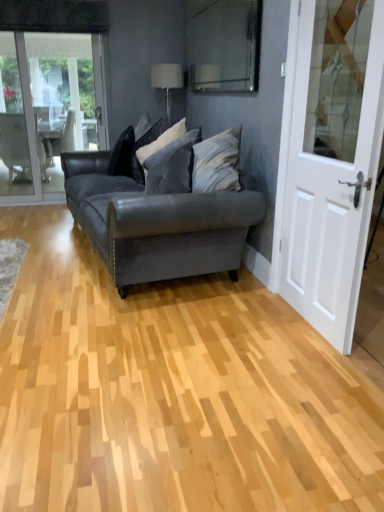
Question: From a real-world perspective, is transparent glass window screen at upper center below white wooden door at right?

Choices:
 (A) yes
 (B) no

Answer: (B)

Question: Is transparent glass window screen at upper center to the left of white wooden door at right from the viewer's perspective?

Choices:
 (A) no
 (B) yes

Answer: (B)

Question: Does transparent glass window screen at upper center appear on the right side of white wooden door at right?

Choices:
 (A) no
 (B) yes

Answer: (A)

Question: From the image's perspective, is transparent glass window screen at upper center below white wooden door at right?

Choices:
 (A) yes
 (B) no

Answer: (B)

Question: Can you confirm if transparent glass window screen at upper center is wider than white wooden door at right?

Choices:
 (A) no
 (B) yes

Answer: (A)

Question: Is transparent glass window screen at upper center thinner than white wooden door at right?

Choices:
 (A) no
 (B) yes

Answer: (B)

Question: Considering the relative sizes of matte black couch at center and transparent glass window screen at upper center in the image provided, is matte black couch at center taller than transparent glass window screen at upper center?

Choices:
 (A) yes
 (B) no

Answer: (A)

Question: From the image's perspective, is matte black couch at center under transparent glass window screen at upper center?

Choices:
 (A) no
 (B) yes

Answer: (B)

Question: Is matte black couch at center surrounding transparent glass window screen at upper center?

Choices:
 (A) yes
 (B) no

Answer: (B)

Question: From a real-world perspective, is matte black couch at center below transparent glass window screen at upper center?

Choices:
 (A) yes
 (B) no

Answer: (A)

Question: Is matte black couch at center further to the viewer compared to transparent glass window screen at upper center?

Choices:
 (A) no
 (B) yes

Answer: (A)

Question: Is matte black couch at center to the left of transparent glass window screen at upper center from the viewer's perspective?

Choices:
 (A) yes
 (B) no

Answer: (A)

Question: From the image's perspective, would you say velvet gray pillow at center, the 3th pillow viewed from the left, is shown under matte black couch at center?

Choices:
 (A) no
 (B) yes

Answer: (A)